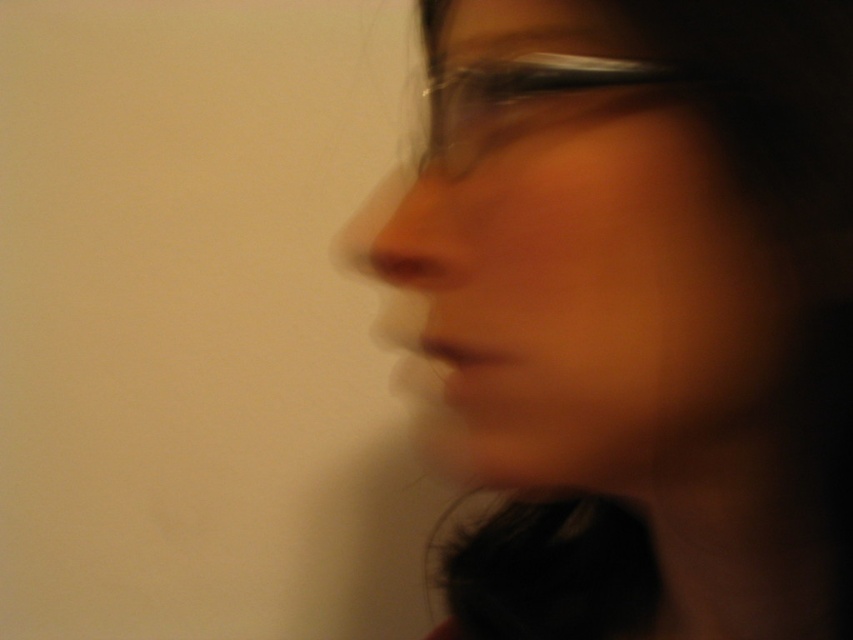
Based on the scene description and the position of the smooth skin face at center, can you determine the coordinates of the face?

The smooth skin face at center is located at coordinates point (593,289).

You are a photographer adjusting the focus on a camera. The subject has a smooth skin face at center and transparent plastic glasses at center. You need to ensure both are in focus. Given that the depth of field can cover 5 centimeters, will both objects be in focus?

The smooth skin face at center is 4.46 centimeters from transparent plastic glasses at center. Since the depth of field can cover 5 centimeters, both objects will be in focus as the distance between them is within the depth of field range.

You are a photographer trying to capture a clear portrait of the person in the image. You notice the smooth skin face at center and the transparent plastic glasses at center. Which object should you adjust your focus on to ensure the face is sharp while keeping the glasses visible?

The smooth skin face at center is larger in size compared to the transparent plastic glasses at center, so adjusting focus on the smooth skin face at center will ensure it is sharp while the glasses remain visible.